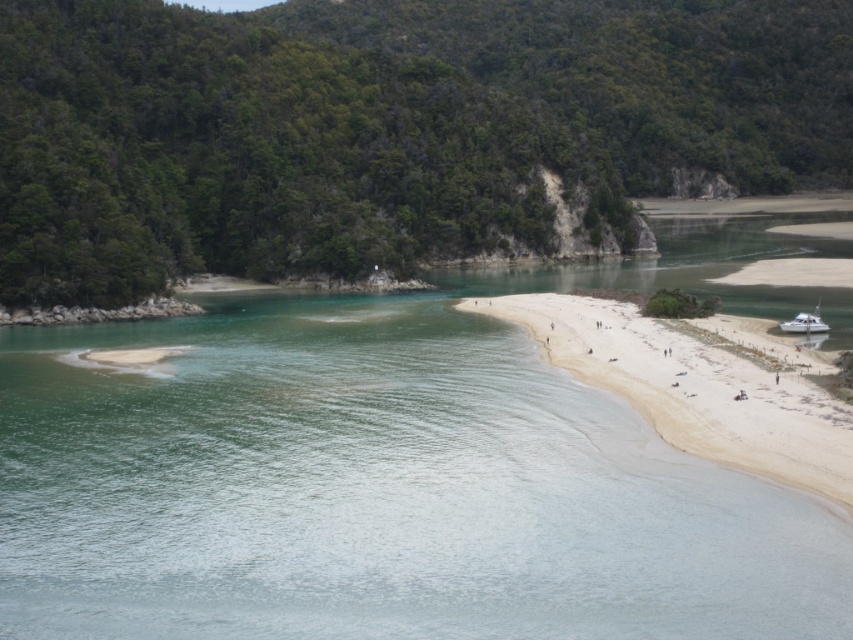
Question: Which point is farther to the camera?

Choices:
 (A) white sandy beach at lower right
 (B) white glossy boat at lower right

Answer: (B)

Question: Is white sandy beach at lower right to the right of white glossy boat at lower right from the viewer's perspective?

Choices:
 (A) no
 (B) yes

Answer: (A)

Question: From the image, what is the correct spatial relationship of white sandy beach at lower right in relation to white glossy boat at lower right?

Choices:
 (A) left
 (B) right

Answer: (A)

Question: Is the position of white sandy beach at lower right less distant than that of white glossy boat at lower right?

Choices:
 (A) yes
 (B) no

Answer: (A)